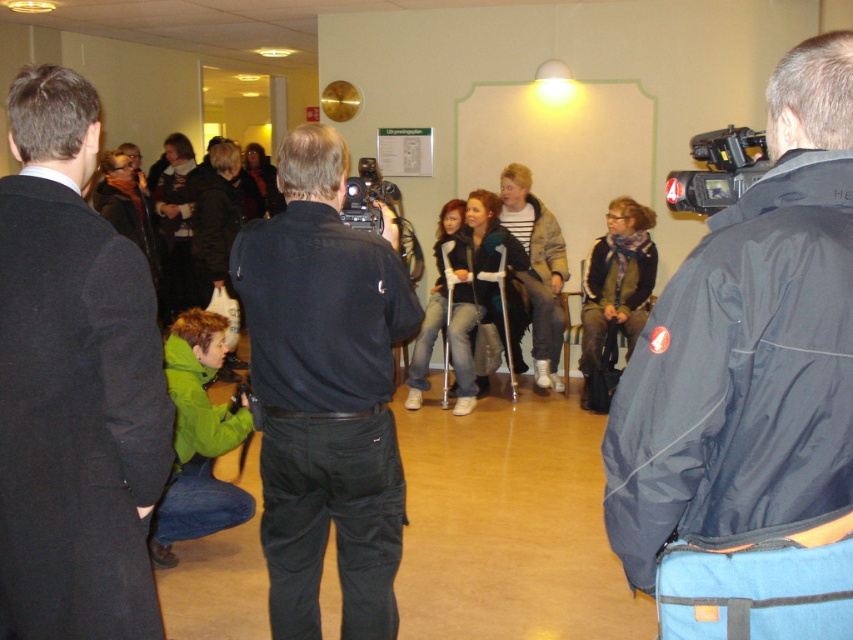
Question: Does black cotton shirt at center have a larger size compared to black plastic video camera at center?

Choices:
 (A) yes
 (B) no

Answer: (A)

Question: Among these objects, which one is farthest from the camera?

Choices:
 (A) black plastic video camera at upper right
 (B) black plastic video camera at center

Answer: (B)

Question: Can you confirm if black plastic video camera at upper right is smaller than black plastic video camera at center?

Choices:
 (A) yes
 (B) no

Answer: (B)

Question: In this image, where is black cotton shirt at center located relative to black plastic video camera at upper right?

Choices:
 (A) right
 (B) left

Answer: (B)

Question: Estimate the real-world distances between objects in this image. Which object is farther from the black plastic video camera at center?

Choices:
 (A) black cotton shirt at center
 (B) dark gray coat at left
 (C) dark blue jacket at center
 (D) black plastic video camera at upper right

Answer: (C)

Question: Which of the following is the farthest from the observer?

Choices:
 (A) black cotton shirt at center
 (B) black plastic video camera at upper right
 (C) dark gray coat at left

Answer: (A)